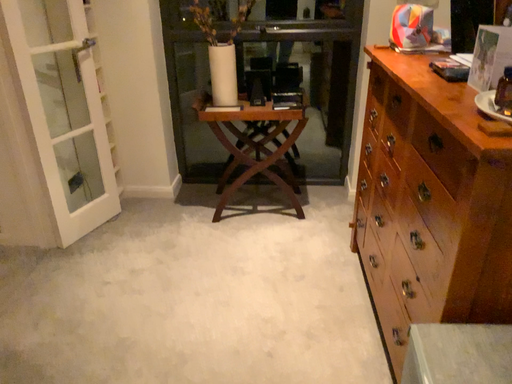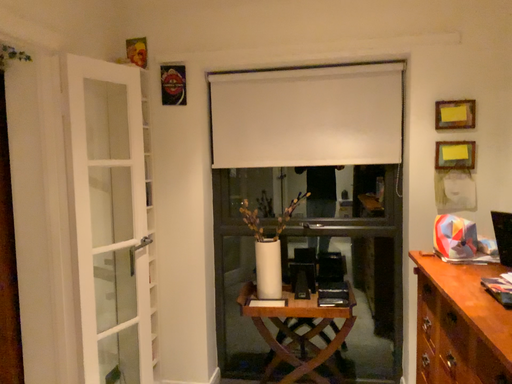
Question: How did the camera likely rotate when shooting the video?

Choices:
 (A) rotated downward
 (B) rotated upward

Answer: (B)